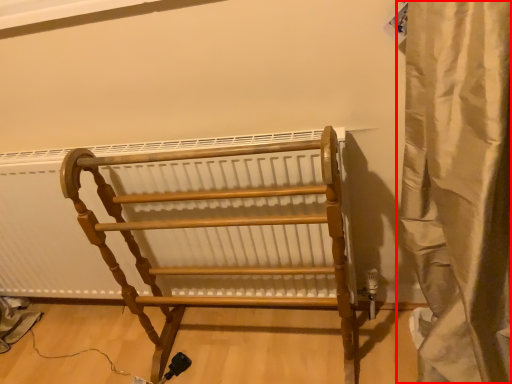
Question: From the image, what is the correct spatial relationship of curtain (annotated by the red box) in relation to furniture?

Choices:
 (A) right
 (B) left

Answer: (A)